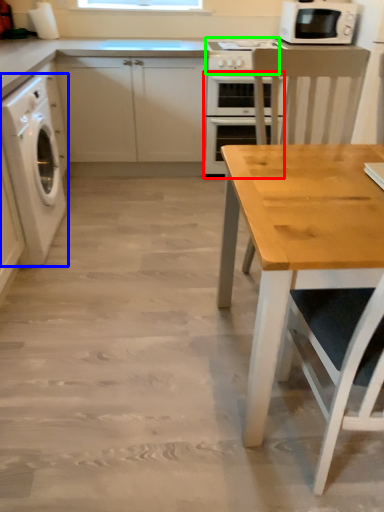
Question: Based on their relative distances, which object is nearer to oven (highlighted by a red box)? Choose from washing machine (highlighted by a blue box) and gas stove (highlighted by a green box).

Choices:
 (A) washing machine
 (B) gas stove

Answer: (B)